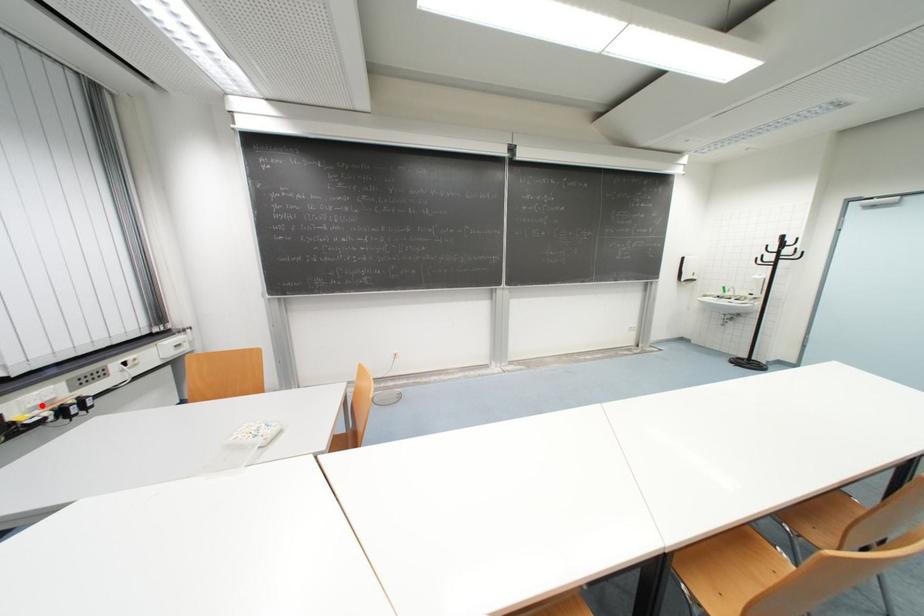
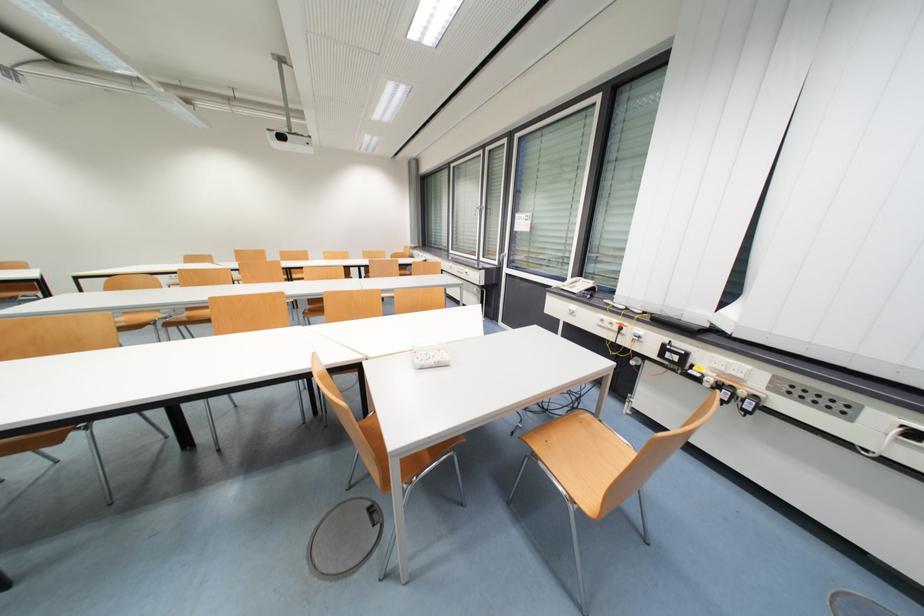
Where in the second image is the point corresponding to the highlighted location from the first image?

(727, 371)